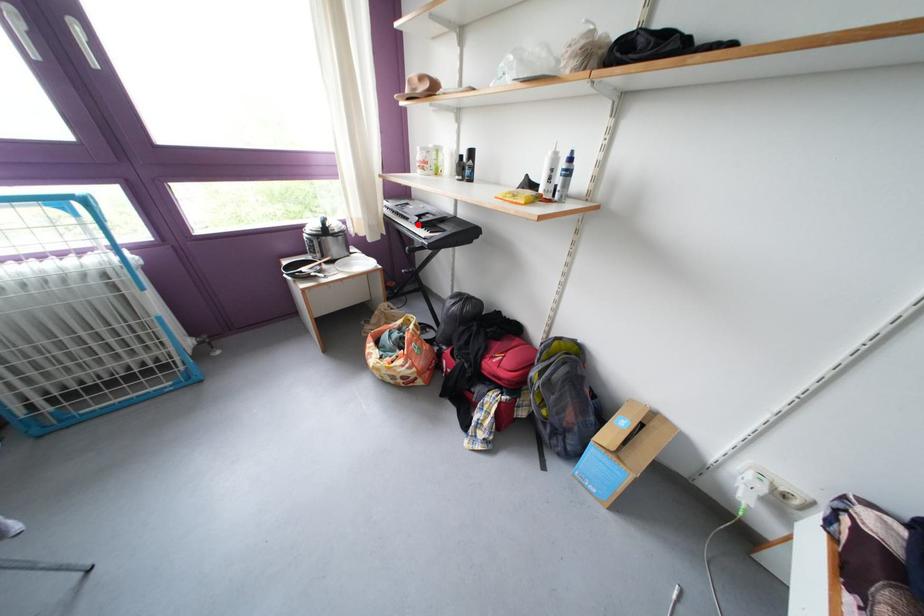
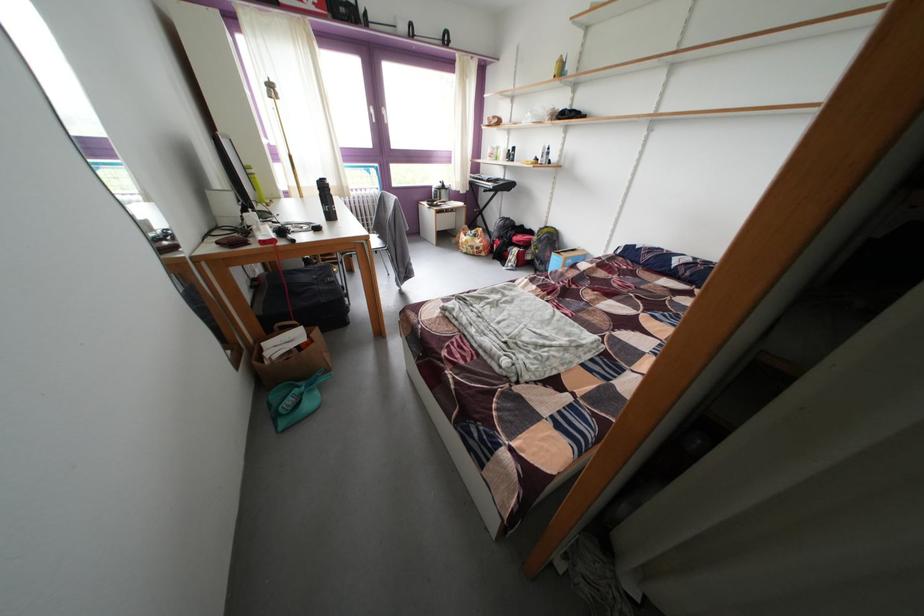
Question: I am providing you with two images of the same scene from different viewpoints. Given a red point in image1, look at the same physical point in image2. Is it:

Choices:
 (A) Closer to the viewpoint
 (B) Farther from the viewpoint

Answer: (A)